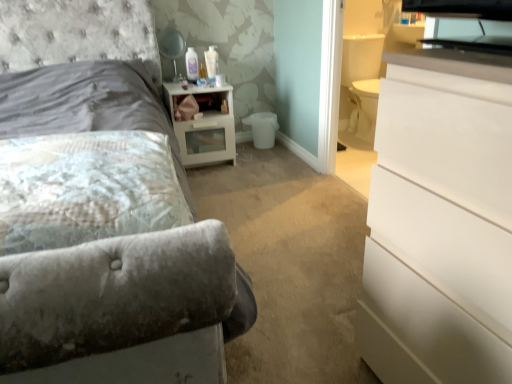
Question: Considering the relative sizes of fluffy white pillow at left and matte black lampshade at upper center in the image provided, is fluffy white pillow at left shorter than matte black lampshade at upper center?

Choices:
 (A) yes
 (B) no

Answer: (A)

Question: Is fluffy white pillow at left taller than matte black lampshade at upper center?

Choices:
 (A) yes
 (B) no

Answer: (B)

Question: From a real-world perspective, is fluffy white pillow at left under matte black lampshade at upper center?

Choices:
 (A) yes
 (B) no

Answer: (A)

Question: Could you tell me if fluffy white pillow at left is facing matte black lampshade at upper center?

Choices:
 (A) no
 (B) yes

Answer: (A)

Question: Considering the relative positions of fluffy white pillow at left and matte black lampshade at upper center in the image provided, is fluffy white pillow at left to the left of matte black lampshade at upper center from the viewer's perspective?

Choices:
 (A) no
 (B) yes

Answer: (A)

Question: From their relative heights in the image, would you say matte black lampshade at upper center is taller or shorter than fluffy white pillow at left?

Choices:
 (A) short
 (B) tall

Answer: (B)

Question: Is matte black lampshade at upper center in front of or behind fluffy white pillow at left in the image?

Choices:
 (A) front
 (B) behind

Answer: (B)

Question: Would you say matte black lampshade at upper center is inside or outside fluffy white pillow at left?

Choices:
 (A) inside
 (B) outside

Answer: (B)

Question: From a real-world perspective, is matte black lampshade at upper center above or below fluffy white pillow at left?

Choices:
 (A) above
 (B) below

Answer: (A)

Question: Based on their sizes in the image, would you say velvet gray bed at upper left is bigger or smaller than matte black lampshade at upper center?

Choices:
 (A) small
 (B) big

Answer: (B)

Question: Visually, is velvet gray bed at upper left positioned to the left or to the right of matte black lampshade at upper center?

Choices:
 (A) left
 (B) right

Answer: (A)

Question: From the image's perspective, is velvet gray bed at upper left positioned above or below matte black lampshade at upper center?

Choices:
 (A) above
 (B) below

Answer: (B)

Question: Is velvet gray bed at upper left taller or shorter than matte black lampshade at upper center?

Choices:
 (A) tall
 (B) short

Answer: (A)

Question: Is fluffy white pillow at left in front of or behind velvet gray bed at upper left in the image?

Choices:
 (A) behind
 (B) front

Answer: (A)

Question: From a real-world perspective, relative to velvet gray bed at upper left, is fluffy white pillow at left vertically above or below?

Choices:
 (A) below
 (B) above

Answer: (A)